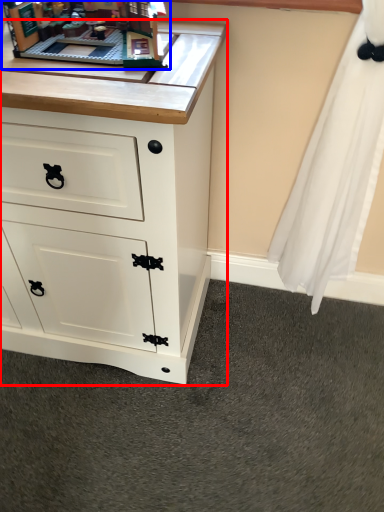
Question: Which object appears closest to the camera in this image, chest of drawers (highlighted by a red box) or toy (highlighted by a blue box)?

Choices:
 (A) chest of drawers
 (B) toy

Answer: (A)